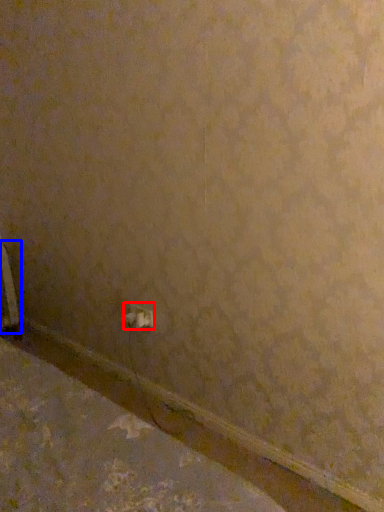
Question: Which point is closer to the camera, power plugs and sockets (highlighted by a red box) or radiator (highlighted by a blue box)?

Choices:
 (A) power plugs and sockets
 (B) radiator

Answer: (A)